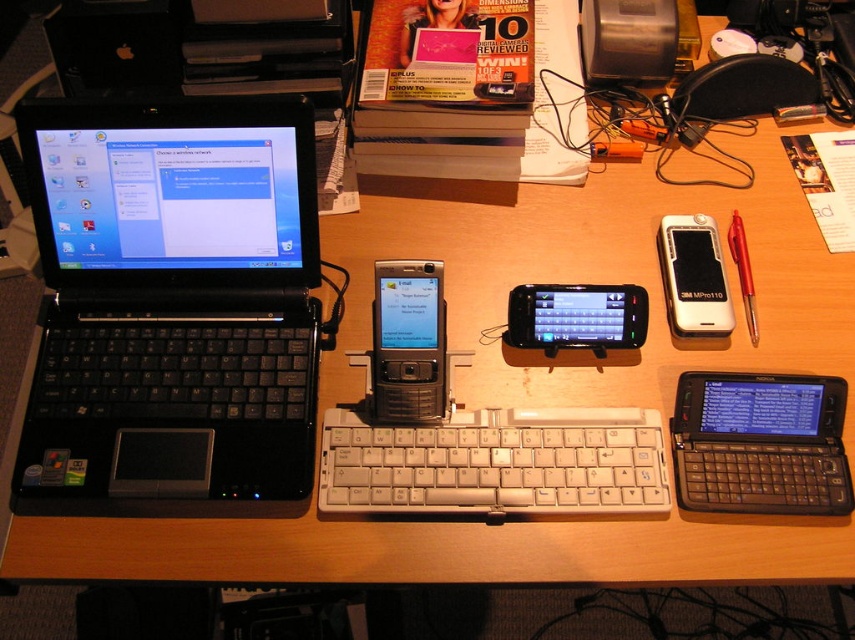
You are holding a 75 cm long measuring tape and want to measure the distance from your current position to the point marked as point (429, 317). Can your measuring tape reach that point without extending beyond its length?

The distance between you and point (429, 317) is 77.12 centimeters. Since your measuring tape is only 75 cm long, it cannot fully reach the point without extending beyond its maximum length.

You need to place the black plastic laptop at center and the red plastic pen at right on a shelf that can only hold items smaller than the laptop. Can both items fit on the shelf?

The black plastic laptop at center is bigger than the red plastic pen at right. Since the shelf can only hold items smaller than the laptop, the red plastic pen at right can fit, but the black plastic laptop at center cannot. Therefore, only the red plastic pen at right will fit on the shelf.